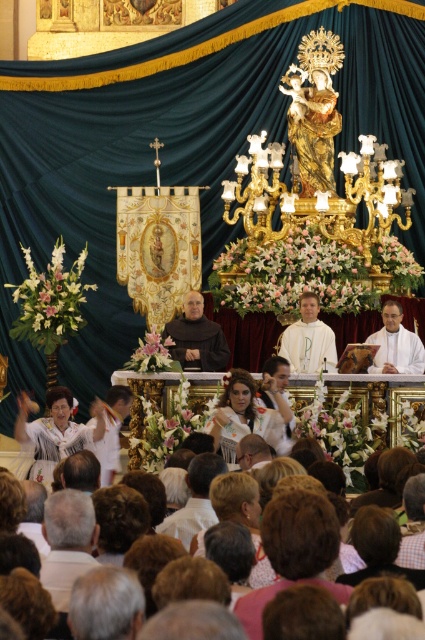
Which is more to the left, white cloth at lower center or white cloth at center?

white cloth at lower center

Between point (56, 596) and point (289, 348), which one is positioned in front?

Positioned in front is point (56, 596).

Is point (62, 556) farther from viewer compared to point (308, 342)?

No.

At what (x,y) coordinates should I click in order to perform the action: click on white cloth at lower center. Please return your answer as a coordinate pair (x, y). The width and height of the screenshot is (425, 640). Looking at the image, I should click on (67, 541).

Consider the image. Can you confirm if black matte robe at center is positioned below white clothed person at center?

Actually, black matte robe at center is above white clothed person at center.

Where is `black matte robe at center`? The width and height of the screenshot is (425, 640). black matte robe at center is located at coordinates (197, 337).

Measure the distance between black matte robe at center and camera.

black matte robe at center and camera are 261.24 feet apart from each other.

Image resolution: width=425 pixels, height=640 pixels. I want to click on black matte robe at center, so click(x=197, y=337).

Which is behind, point (57, 525) or point (391, 321)?

The point (391, 321) is more distant.

Looking at this image, can you confirm if white cloth at lower center is bigger than white clothed person at center?

Indeed, white cloth at lower center has a larger size compared to white clothed person at center.

Does point (65, 513) come behind point (384, 308)?

That is False.

At what (x,y) coordinates should I click in order to perform the action: click on white cloth at lower center. Please return your answer as a coordinate pair (x, y). This screenshot has width=425, height=640. Looking at the image, I should click on (67, 541).